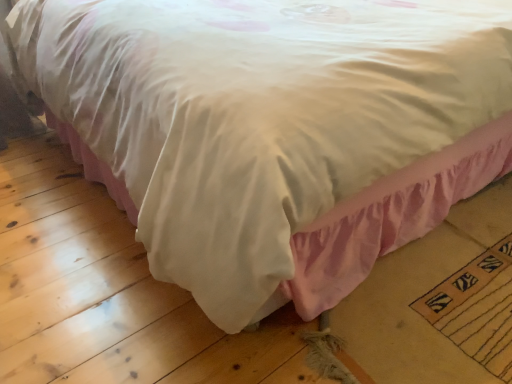
This screenshot has width=512, height=384. Find the location of `blank area to the left of yellow woven mat at lower right`. blank area to the left of yellow woven mat at lower right is located at coordinates (387, 304).